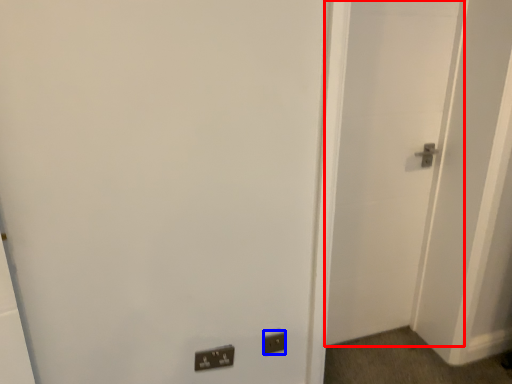
Question: Which of the following is the farthest to the observer, door (highlighted by a red box) or electric outlet (highlighted by a blue box)?

Choices:
 (A) door
 (B) electric outlet

Answer: (B)